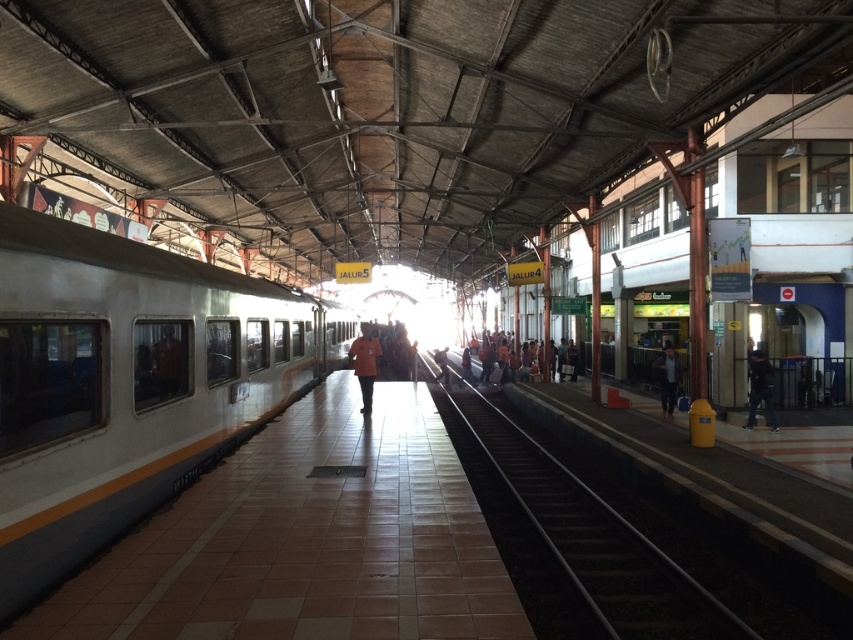
Can you confirm if silver metallic train at left is positioned to the left of black asphalt train track at center?

Indeed, silver metallic train at left is positioned on the left side of black asphalt train track at center.

Which is behind, point (47, 326) or point (552, 468)?

Point (552, 468)

Where is `silver metallic train at left`? The width and height of the screenshot is (853, 640). silver metallic train at left is located at coordinates (128, 384).

Who is lower down, brown tile platform at center or black matte person at right?

brown tile platform at center is below.

Does brown tile platform at center appear on the right side of black matte person at right?

Incorrect, brown tile platform at center is not on the right side of black matte person at right.

Does point (154, 595) come behind point (764, 371)?

No, it is in front of (764, 371).

Image resolution: width=853 pixels, height=640 pixels. Find the location of `brown tile platform at center`. brown tile platform at center is located at coordinates (306, 540).

You are a GUI agent. You are given a task and a screenshot of the screen. Output one action in this format:
    pyautogui.click(x=<x>, y=<y>)
    Task: Click on the brown tile platform at center
    
    Given the screenshot: What is the action you would take?
    pos(306,540)

Can you confirm if brown tile platform at center is smaller than dark blue jeans at lower right?

Yes.

Between point (256, 588) and point (660, 356), which one is positioned in front?

Point (256, 588) is in front.

Locate an element on the screen. Image resolution: width=853 pixels, height=640 pixels. brown tile platform at center is located at coordinates (306, 540).